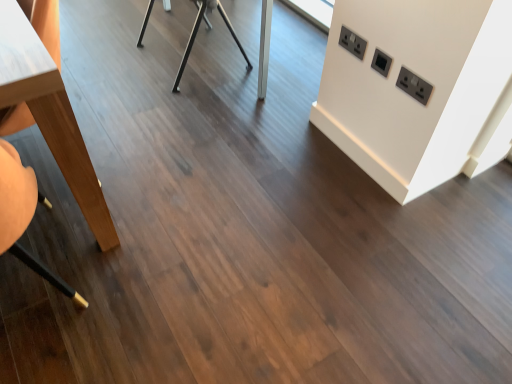
Find the location of a particular element. free space to the right of wooden swivel chair at left is located at coordinates (156, 278).